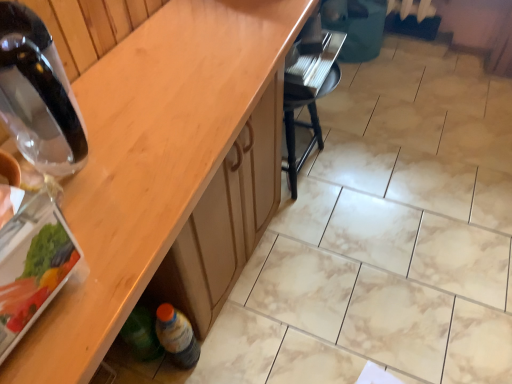
Question: Could you tell me if wooden at lower left is turned towards transparent glass bottle at left, which is the 2th bottle from bottom to top?

Choices:
 (A) yes
 (B) no

Answer: (B)

Question: From a real-world perspective, is wooden at lower left below transparent glass bottle at left, which is the second bottle from back to front?

Choices:
 (A) no
 (B) yes

Answer: (B)

Question: Is wooden at lower left positioned with its back to transparent glass bottle at left, the first bottle viewed from the front?

Choices:
 (A) no
 (B) yes

Answer: (A)

Question: From the image's perspective, does wooden at lower left appear higher than transparent glass bottle at left, which is the second bottle from back to front?

Choices:
 (A) no
 (B) yes

Answer: (A)

Question: From a real-world perspective, is wooden at lower left over transparent glass bottle at left, positioned as the 1th bottle in top-to-bottom order?

Choices:
 (A) yes
 (B) no

Answer: (B)

Question: Does wooden at lower left come behind transparent glass bottle at left, which is the second bottle from back to front?

Choices:
 (A) no
 (B) yes

Answer: (A)

Question: From the image's perspective, is translucent plastic bottle at lower left, the first bottle from the back, under transparent glass bottle at left, positioned as the 1th bottle in top-to-bottom order?

Choices:
 (A) no
 (B) yes

Answer: (B)

Question: Considering the relative positions of translucent plastic bottle at lower left, which is the 2th bottle from front to back, and transparent glass bottle at left, the first bottle viewed from the front, in the image provided, is translucent plastic bottle at lower left, which is the 2th bottle from front to back, to the left of transparent glass bottle at left, the first bottle viewed from the front, from the viewer's perspective?

Choices:
 (A) no
 (B) yes

Answer: (A)

Question: Is transparent glass bottle at left, which is the 2th bottle from bottom to top, at the back of translucent plastic bottle at lower left, placed as the 2th bottle when sorted from top to bottom?

Choices:
 (A) no
 (B) yes

Answer: (A)

Question: Considering the relative sizes of translucent plastic bottle at lower left, placed as the 2th bottle when sorted from top to bottom, and transparent glass bottle at left, positioned as the 1th bottle in top-to-bottom order, in the image provided, is translucent plastic bottle at lower left, placed as the 2th bottle when sorted from top to bottom, shorter than transparent glass bottle at left, positioned as the 1th bottle in top-to-bottom order,?

Choices:
 (A) yes
 (B) no

Answer: (B)

Question: Does translucent plastic bottle at lower left, which is the 2th bottle from front to back, appear on the right side of transparent glass bottle at left, which is the 2th bottle from bottom to top?

Choices:
 (A) yes
 (B) no

Answer: (A)

Question: Does translucent plastic bottle at lower left, which is the 2th bottle from front to back, turn towards transparent glass bottle at left, the first bottle viewed from the front?

Choices:
 (A) yes
 (B) no

Answer: (B)

Question: Is wooden at lower left to the right of translucent plastic bottle at lower left, which is the 2th bottle from front to back, from the viewer's perspective?

Choices:
 (A) yes
 (B) no

Answer: (A)